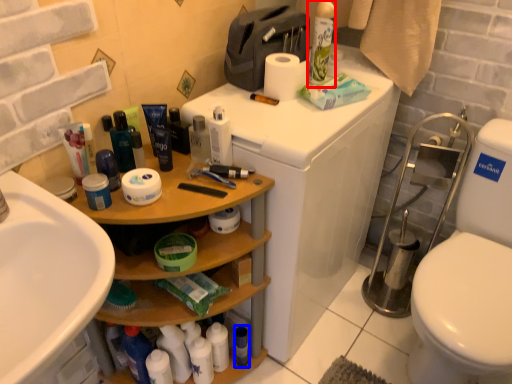
Question: Which object is closer to the camera taking this photo, cleaning product (highlighted by a red box) or toiletry (highlighted by a blue box)?

Choices:
 (A) cleaning product
 (B) toiletry

Answer: (A)